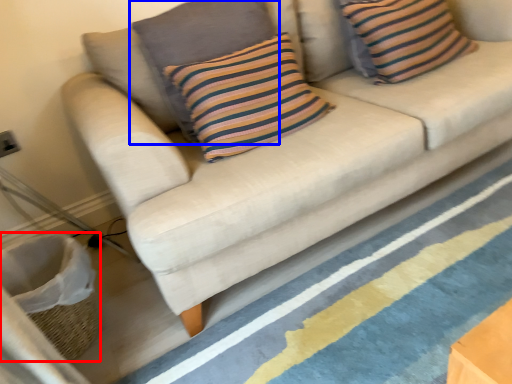
Question: Which object appears closest to the camera in this image, basket (highlighted by a red box) or pillow (highlighted by a blue box)?

Choices:
 (A) basket
 (B) pillow

Answer: (A)